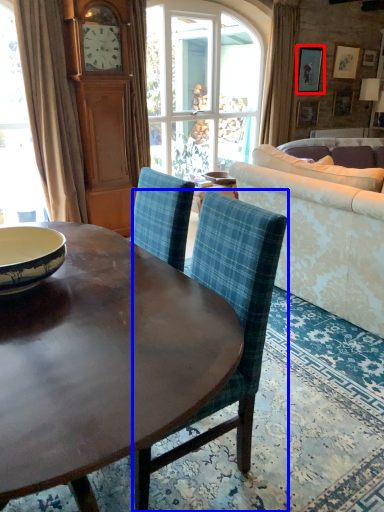
Question: Among these objects, which one is nearest to the camera, picture frame (highlighted by a red box) or chair (highlighted by a blue box)?

Choices:
 (A) picture frame
 (B) chair

Answer: (B)